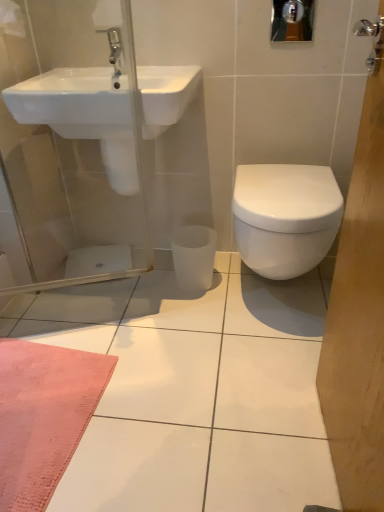
Question: Is white glossy sink at upper left further to the viewer compared to silver metallic tap at upper left?

Choices:
 (A) yes
 (B) no

Answer: (B)

Question: Can you confirm if white glossy sink at upper left is shorter than silver metallic tap at upper left?

Choices:
 (A) yes
 (B) no

Answer: (B)

Question: Considering the relative sizes of white glossy sink at upper left and silver metallic tap at upper left in the image provided, is white glossy sink at upper left smaller than silver metallic tap at upper left?

Choices:
 (A) yes
 (B) no

Answer: (B)

Question: Would you consider white glossy sink at upper left to be distant from silver metallic tap at upper left?

Choices:
 (A) yes
 (B) no

Answer: (B)

Question: Is silver metallic tap at upper left located within white glossy sink at upper left?

Choices:
 (A) yes
 (B) no

Answer: (B)

Question: Does white glossy sink at upper left have a lesser width compared to silver metallic tap at upper left?

Choices:
 (A) no
 (B) yes

Answer: (A)

Question: From the image's perspective, does silver metallic tap at upper left appear lower than white glossy sink at upper left?

Choices:
 (A) yes
 (B) no

Answer: (B)

Question: Is silver metallic tap at upper left facing away from white glossy sink at upper left?

Choices:
 (A) no
 (B) yes

Answer: (A)

Question: Would you consider silver metallic tap at upper left to be distant from white glossy sink at upper left?

Choices:
 (A) yes
 (B) no

Answer: (B)

Question: Is silver metallic tap at upper left positioned behind white glossy sink at upper left?

Choices:
 (A) yes
 (B) no

Answer: (A)

Question: From a real-world perspective, does silver metallic tap at upper left sit lower than white glossy sink at upper left?

Choices:
 (A) yes
 (B) no

Answer: (B)

Question: Is silver metallic tap at upper left wider than white glossy sink at upper left?

Choices:
 (A) yes
 (B) no

Answer: (B)

Question: Considering the relative sizes of white glossy toilet at right and white glossy sink at upper left in the image provided, is white glossy toilet at right smaller than white glossy sink at upper left?

Choices:
 (A) no
 (B) yes

Answer: (A)